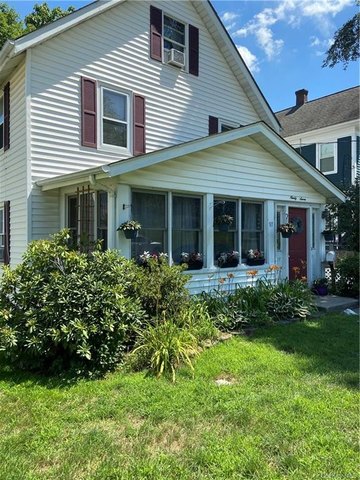
Locate an element on the screen. This screenshot has height=480, width=360. hanging pots is located at coordinates (286, 225), (127, 230), (329, 229).